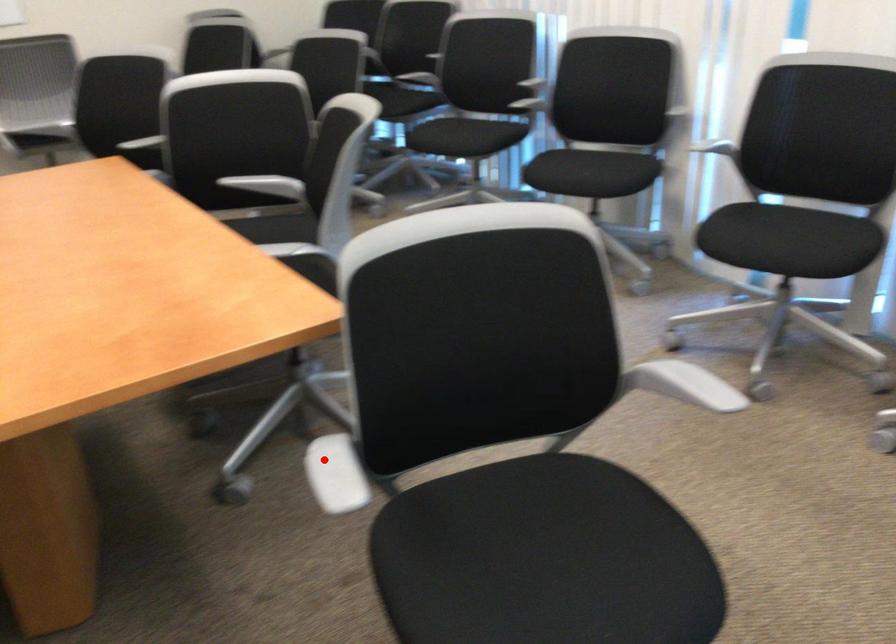
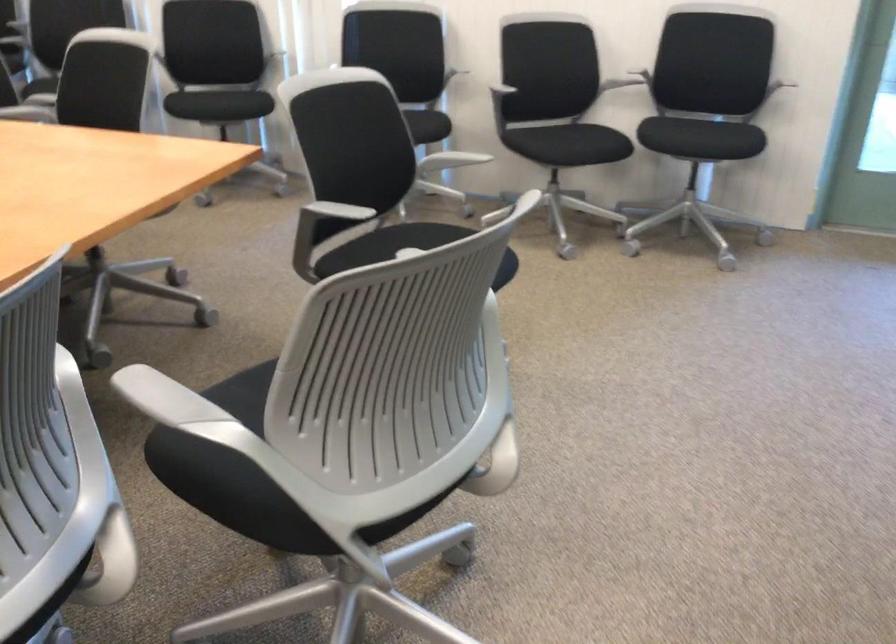
Question: I am providing you with two images of the same scene from different viewpoints. A red point is shown in image1. For the corresponding object point in image2, is it positioned nearer or farther from the camera?

Choices:
 (A) Nearer
 (B) Farther

Answer: (B)